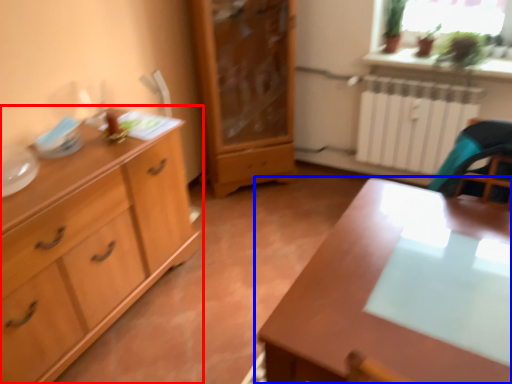
Question: Which object is closer to the camera taking this photo, chest of drawers (highlighted by a red box) or table (highlighted by a blue box)?

Choices:
 (A) chest of drawers
 (B) table

Answer: (B)